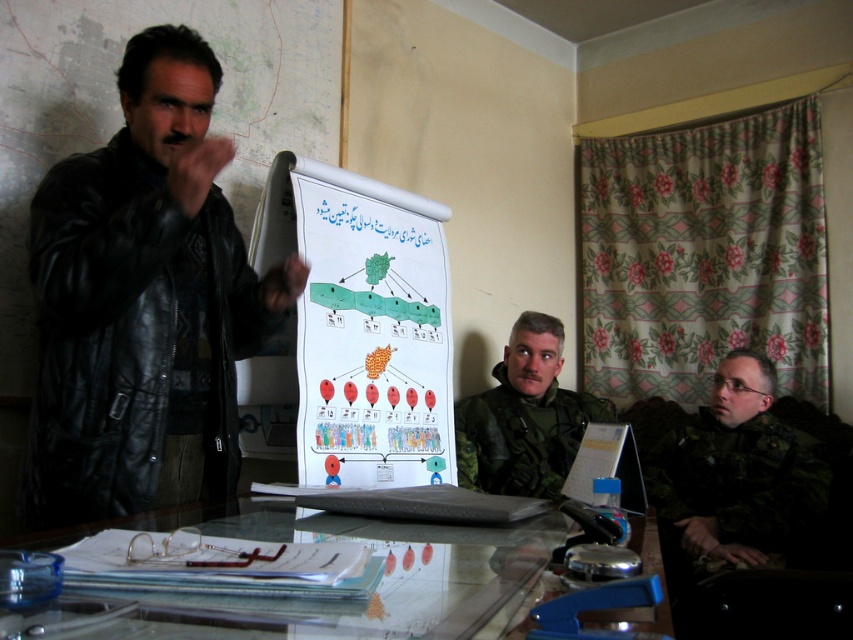
Who is positioned more to the left, black leather jacket at left or camouflage uniform at right?

black leather jacket at left

Can you confirm if black leather jacket at left is positioned to the right of camouflage uniform at right?

No, black leather jacket at left is not to the right of camouflage uniform at right.

In order to click on black leather jacket at left in this screenshot , I will do `click(131, 333)`.

From the picture: Which is more to the left, white paper poster at center or transparent glass table at center?

white paper poster at center

Describe the element at coordinates (370, 333) in the screenshot. I see `white paper poster at center` at that location.

The image size is (853, 640). I want to click on white paper poster at center, so click(x=370, y=333).

Can you confirm if black leather jacket at left is bigger than white paper poster at center?

No.

The height and width of the screenshot is (640, 853). Identify the location of black leather jacket at left. (131, 333).

Where is `black leather jacket at left`? This screenshot has height=640, width=853. black leather jacket at left is located at coordinates (131, 333).